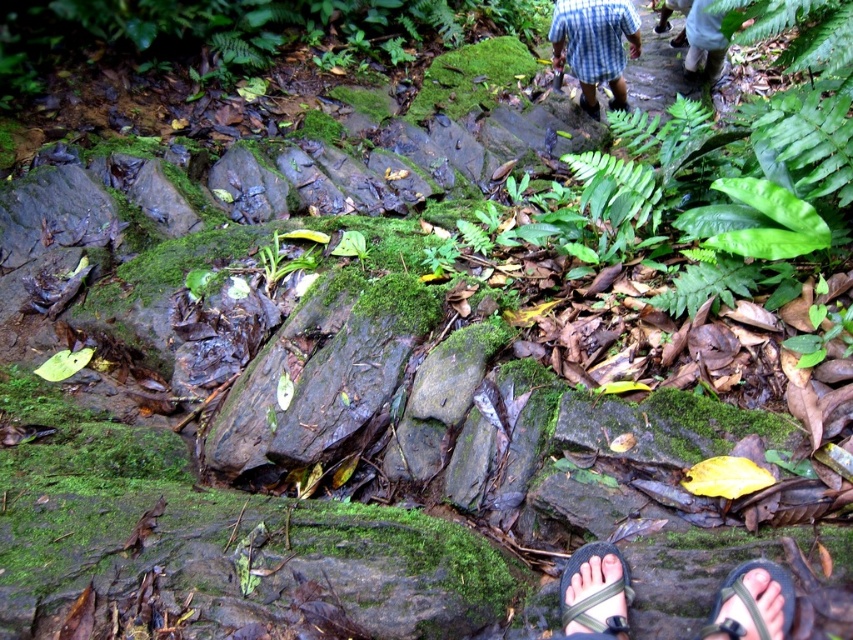
Question: Which object appears closest to the camera in this image?

Choices:
 (A) black fabric sandal at lower right
 (B) brown leather sandal at center

Answer: (A)

Question: Is black fabric sandal at lower right thinner than brown leather sandal at center?

Choices:
 (A) yes
 (B) no

Answer: (B)

Question: Is blue plaid shirt at upper center below brown leather sandal at center?

Choices:
 (A) no
 (B) yes

Answer: (A)

Question: Can you confirm if blue plaid shirt at upper center is bigger than black fabric sandal at lower right?

Choices:
 (A) no
 (B) yes

Answer: (B)

Question: Which of these objects is positioned closest to the black fabric sandal at lower right?

Choices:
 (A) blue plaid shirt at upper center
 (B) brown leather sandal at center

Answer: (A)

Question: Estimate the real-world distances between objects in this image. Which object is closer to the blue plaid shirt at upper center?

Choices:
 (A) black rubber sandal at lower center
 (B) brown leather sandal at center

Answer: (B)